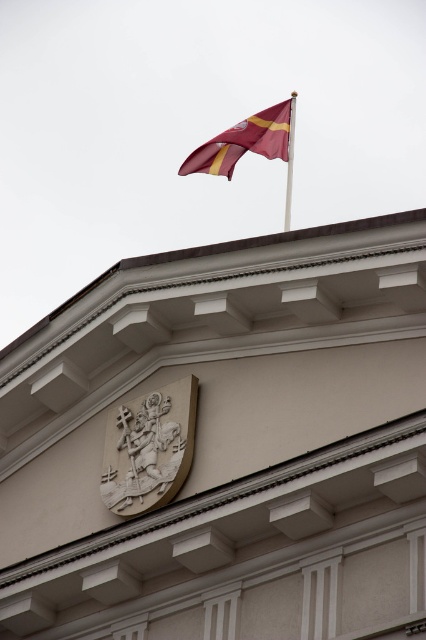
You are a maintenance worker inspecting the building facade. You notice the maroon fabric flag at upper center and the metallic flag pole at upper center. Which object would cast a longer shadow during midday when the sun is directly overhead?

The maroon fabric flag at upper center is larger in size than the metallic flag pole at upper center, so it would cast a longer shadow during midday when the sun is directly overhead.